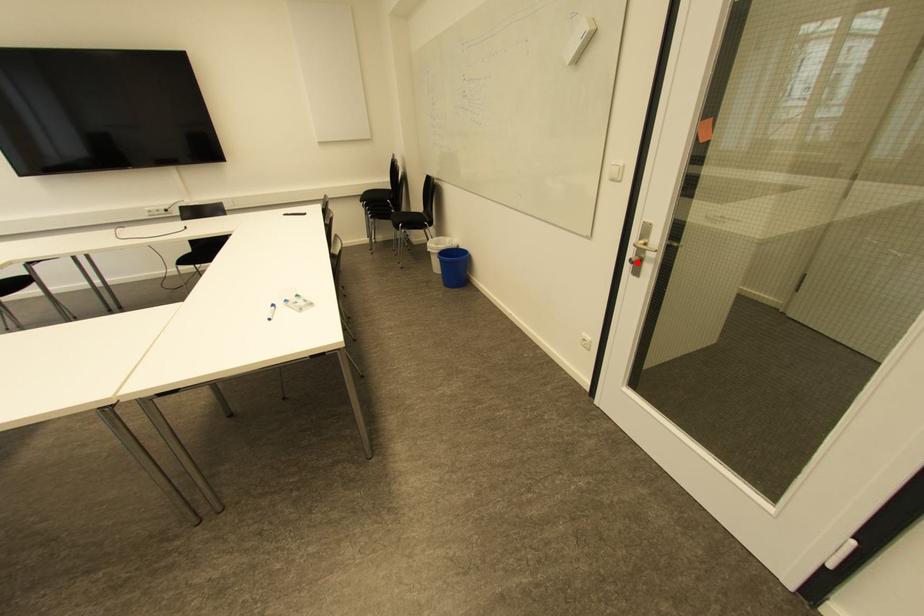
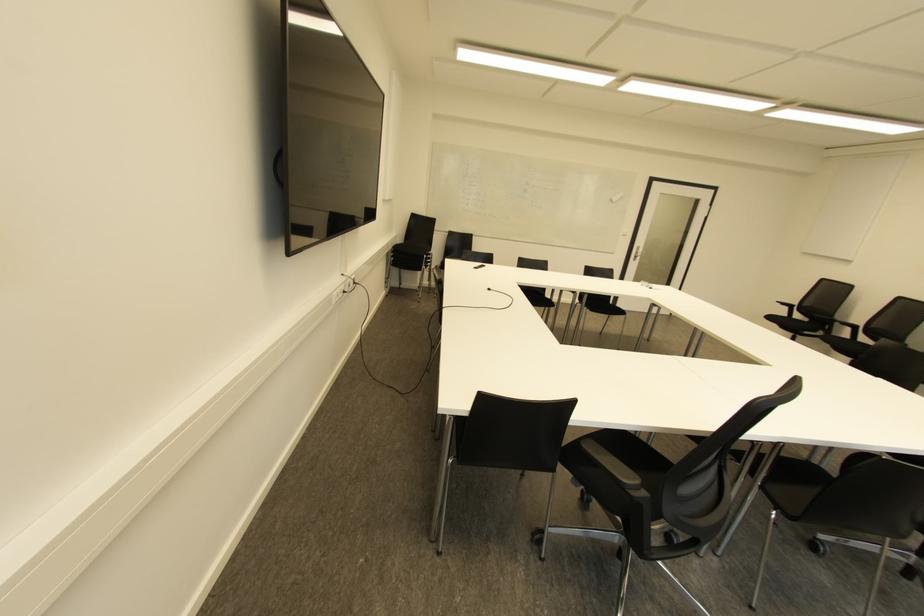
The point at the highlighted location is marked in the first image. Where is the corresponding point in the second image?

(636, 257)